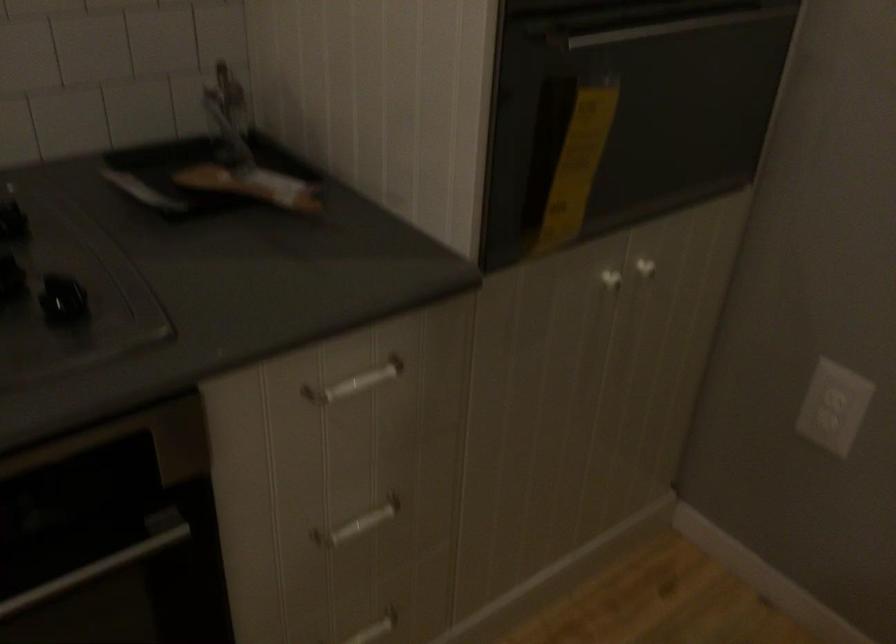
Question: How did the camera likely rotate?

Choices:
 (A) Left
 (B) Right
 (C) Up
 (D) Down

Answer: (B)